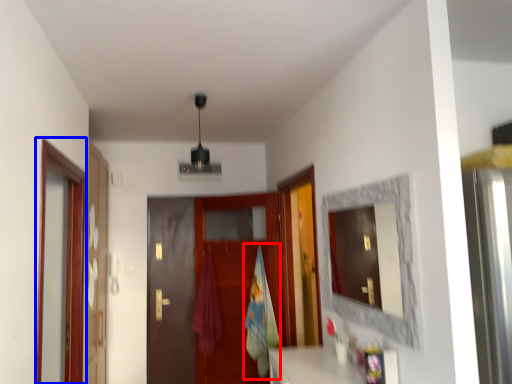
Question: Which object is further to the camera taking this photo, beach towel (highlighted by a red box) or screen door (highlighted by a blue box)?

Choices:
 (A) beach towel
 (B) screen door

Answer: (A)